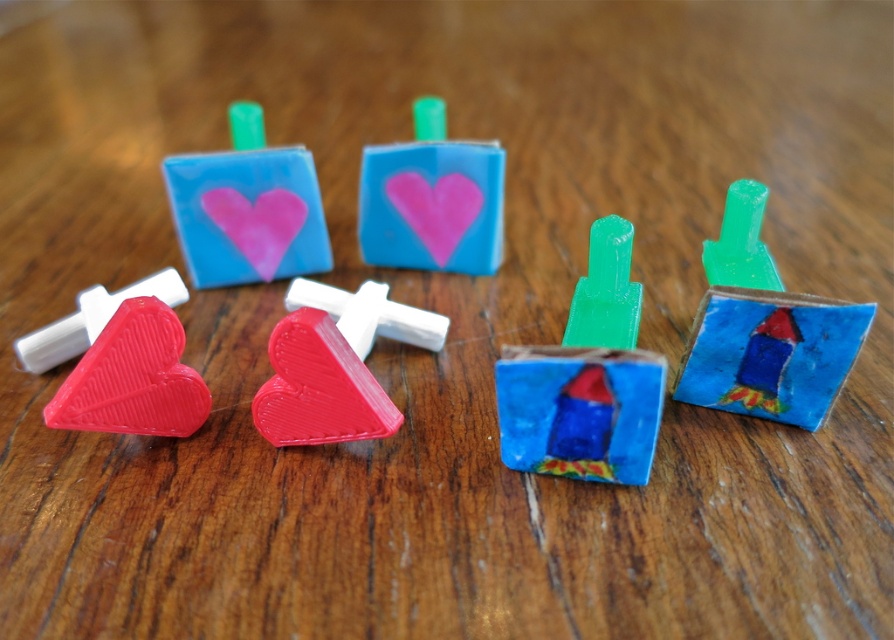
You are a delivery robot with a 24 inch wide arm. You need to place a small package between the matte red heart at lower left and the pink matte heart at center. Can your arm fit through the space between them?

The distance between the matte red heart at lower left and the pink matte heart at center is 24.32 inches, so yes, the robot arm can fit through the space since it is wider than the arm.

You are a customer at a craft store looking at the matte red heart at lower left and the pink matte heart at center. Which one can you reach without moving your current position?

The matte red heart at lower left is closer to the viewer than the pink matte heart at center, so you can reach the matte red heart at lower left without moving.